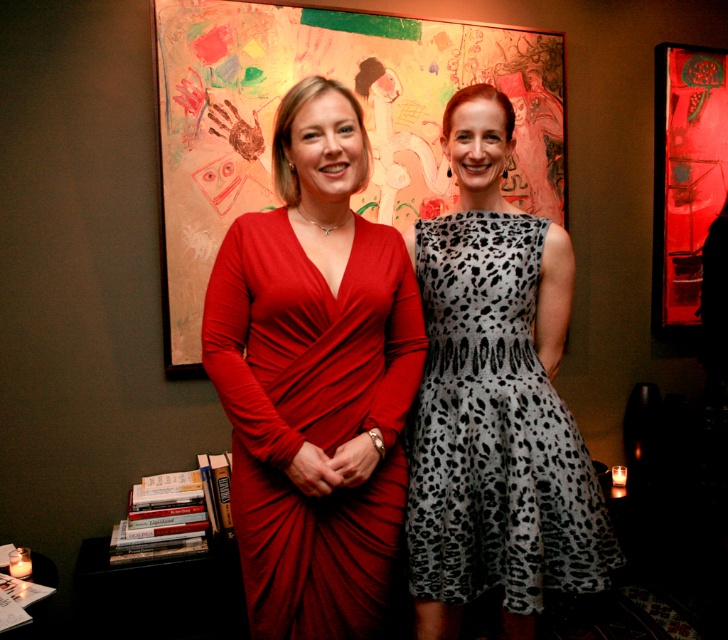
Question: Which is nearer to the painted canvas artwork at center?

Choices:
 (A) matte red dress at center
 (B) gray leopard print dress at center

Answer: (A)

Question: Which point is farther to the camera?

Choices:
 (A) (349, 214)
 (B) (414, 93)
 (C) (558, 397)

Answer: (B)

Question: Which point is closer to the camera?

Choices:
 (A) (510, 605)
 (B) (242, 28)
 (C) (292, 195)

Answer: (A)

Question: Considering the relative positions of matte red dress at center and painted canvas artwork at center in the image provided, where is matte red dress at center located with respect to painted canvas artwork at center?

Choices:
 (A) right
 (B) left

Answer: (B)

Question: Observing the image, what is the correct spatial positioning of painted canvas artwork at center in reference to gray leopard print dress at center?

Choices:
 (A) above
 (B) below

Answer: (A)

Question: Does matte red dress at center have a larger size compared to gray leopard print dress at center?

Choices:
 (A) yes
 (B) no

Answer: (A)